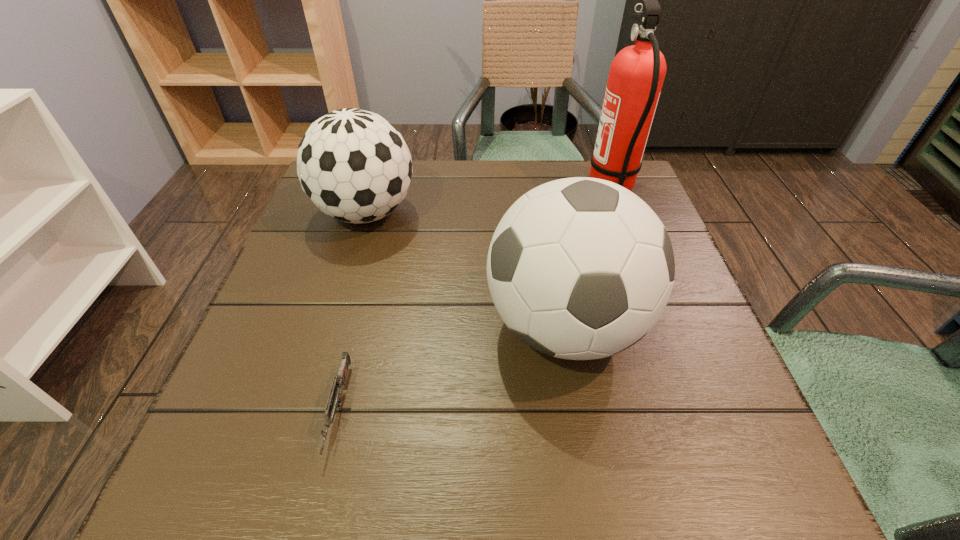
Image resolution: width=960 pixels, height=540 pixels. What are the coordinates of `vacant position at the near edge of the desktop` in the screenshot? It's located at (333, 489).

Identify the location of blank area at the left edge. This screenshot has height=540, width=960. (355, 241).

In order to click on free space at the right edge in this screenshot , I will do `click(658, 346)`.

Where is `vacant space at the near right corner of the desktop`? vacant space at the near right corner of the desktop is located at coordinates (686, 481).

This screenshot has height=540, width=960. Find the location of `free space that is in between the gun and the left soccer ball`. free space that is in between the gun and the left soccer ball is located at coordinates (352, 311).

Locate an element on the screen. empty space between the tallest object and the left soccer ball is located at coordinates (489, 201).

Identify the location of vacant area between the right soccer ball and the left soccer ball. (466, 269).

Find the location of a particular element. Image resolution: width=960 pixels, height=540 pixels. free spot between the shorter soccer ball and the shortest object is located at coordinates (352, 311).

I want to click on free space that is in between the gun and the right soccer ball, so click(452, 368).

Locate an element on the screen. vacant area between the shortest object and the second tallest object is located at coordinates (452, 368).